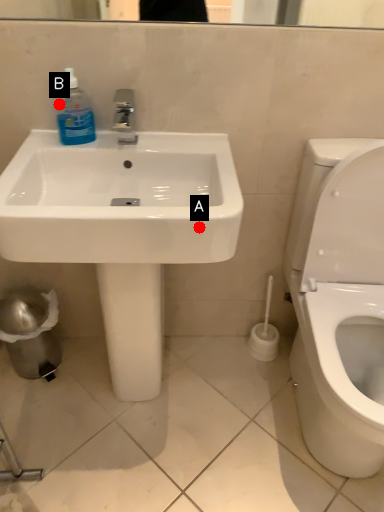
Question: Two points are circled on the image, labeled by A and B beside each circle. Which point is further to the camera?

Choices:
 (A) A is further
 (B) B is further

Answer: (B)